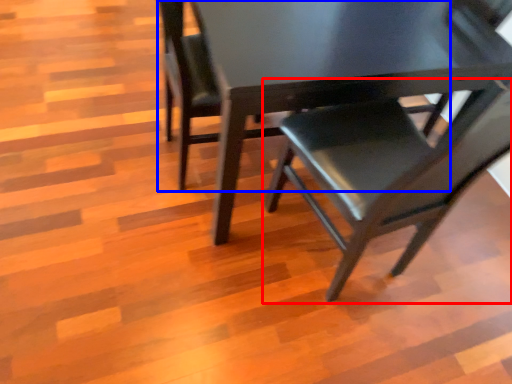
Question: Which object appears farthest to the camera in this image, chair (highlighted by a red box) or chair (highlighted by a blue box)?

Choices:
 (A) chair
 (B) chair

Answer: (B)